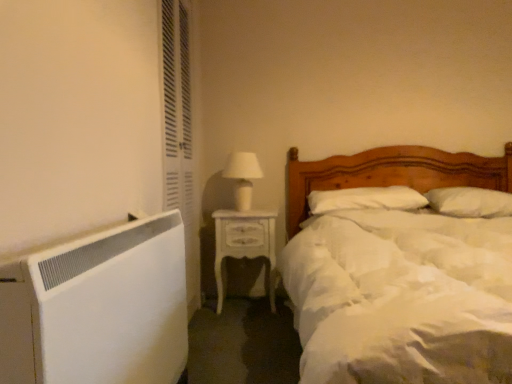
Question: Does white soft pillow at upper right, the 2th pillow in the left-to-right sequence, have a greater width compared to white textured screen door at left?

Choices:
 (A) no
 (B) yes

Answer: (B)

Question: Is white soft pillow at upper right, the 2th pillow in the left-to-right sequence, oriented towards white textured screen door at left?

Choices:
 (A) no
 (B) yes

Answer: (A)

Question: Does white soft pillow at upper right, acting as the 1th pillow starting from the right, come in front of white textured screen door at left?

Choices:
 (A) no
 (B) yes

Answer: (A)

Question: Considering the relative sizes of white soft pillow at upper right, acting as the 1th pillow starting from the right, and white textured screen door at left in the image provided, is white soft pillow at upper right, acting as the 1th pillow starting from the right, smaller than white textured screen door at left?

Choices:
 (A) no
 (B) yes

Answer: (B)

Question: Can you confirm if white soft pillow at upper right, the 2th pillow in the left-to-right sequence, is thinner than white textured screen door at left?

Choices:
 (A) yes
 (B) no

Answer: (B)

Question: Visually, is white textured screen door at left positioned to the left or to the right of white soft pillow at center, which is the 1th pillow in left-to-right order?

Choices:
 (A) left
 (B) right

Answer: (A)

Question: Considering the positions of point (177, 11) and point (361, 205), is point (177, 11) closer or farther from the camera than point (361, 205)?

Choices:
 (A) farther
 (B) closer

Answer: (B)

Question: Do you think white textured screen door at left is within white soft pillow at center, marked as the second pillow in a right-to-left arrangement, or outside of it?

Choices:
 (A) inside
 (B) outside

Answer: (B)

Question: In the image, is white textured screen door at left positioned in front of or behind white soft pillow at center, marked as the second pillow in a right-to-left arrangement?

Choices:
 (A) behind
 (B) front

Answer: (B)

Question: Is white glossy nightstand at center in front of or behind white matte wood bed at center in the image?

Choices:
 (A) front
 (B) behind

Answer: (B)

Question: Looking at their shapes, would you say white glossy nightstand at center is wider or thinner than white matte wood bed at center?

Choices:
 (A) thin
 (B) wide

Answer: (A)

Question: In the image, is white glossy nightstand at center on the left side or the right side of white matte wood bed at center?

Choices:
 (A) left
 (B) right

Answer: (A)

Question: From a real-world perspective, is white glossy nightstand at center physically located above or below white matte wood bed at center?

Choices:
 (A) above
 (B) below

Answer: (B)

Question: Considering their positions, is white matte wood bed at center located in front of or behind white soft pillow at upper right, acting as the 1th pillow starting from the right?

Choices:
 (A) behind
 (B) front

Answer: (B)

Question: In terms of size, does white matte wood bed at center appear bigger or smaller than white soft pillow at upper right, acting as the 1th pillow starting from the right?

Choices:
 (A) small
 (B) big

Answer: (B)